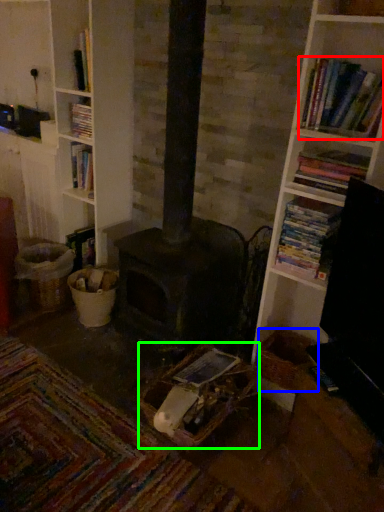
Question: Based on their relative distances, which object is farther from book (highlighted by a red box)? Choose from basket (highlighted by a blue box) and basket (highlighted by a green box).

Choices:
 (A) basket
 (B) basket

Answer: (B)